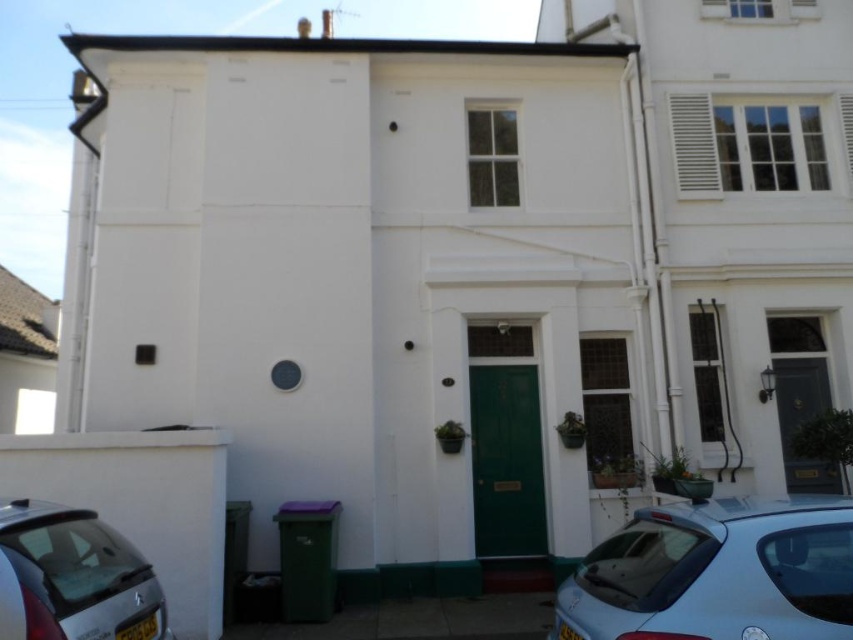
Which of these two, light blue metallic hatchback at lower right or silver metallic car at lower left, stands shorter?

light blue metallic hatchback at lower right

Find the location of a particular element. The image size is (853, 640). light blue metallic hatchback at lower right is located at coordinates (717, 573).